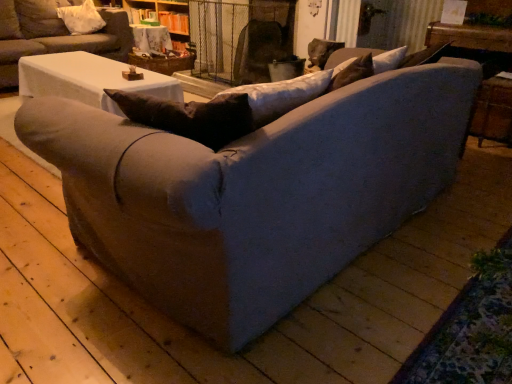
Question: Would you say white fabric pillow at upper left contains matte gray couch at center, arranged as the second studio couch when ordered from the bottom?

Choices:
 (A) yes
 (B) no

Answer: (B)

Question: Is white fabric pillow at upper left smaller than matte gray couch at center, arranged as the second studio couch when ordered from the bottom?

Choices:
 (A) no
 (B) yes

Answer: (B)

Question: Is white fabric pillow at upper left oriented away from matte gray couch at center, arranged as the second studio couch when ordered from the bottom?

Choices:
 (A) no
 (B) yes

Answer: (B)

Question: From a real-world perspective, is white fabric pillow at upper left positioned over matte gray couch at center, the 1th studio couch from the top, based on gravity?

Choices:
 (A) yes
 (B) no

Answer: (A)

Question: Considering the relative sizes of white fabric pillow at upper left and matte gray couch at center, arranged as the second studio couch when ordered from the bottom, in the image provided, is white fabric pillow at upper left thinner than matte gray couch at center, arranged as the second studio couch when ordered from the bottom,?

Choices:
 (A) yes
 (B) no

Answer: (A)

Question: Is matte gray couch at center, arranged as the second studio couch when ordered from the bottom, to the left or to the right of wooden textured table at upper center in the image?

Choices:
 (A) right
 (B) left

Answer: (B)

Question: From the image's perspective, is matte gray couch at center, the 1th studio couch from the top, above or below wooden textured table at upper center?

Choices:
 (A) below
 (B) above

Answer: (A)

Question: Is point (14, 84) positioned closer to the camera than point (133, 33)?

Choices:
 (A) closer
 (B) farther

Answer: (A)

Question: Considering the positions of matte gray couch at center, arranged as the second studio couch when ordered from the bottom, and wooden textured table at upper center in the image, is matte gray couch at center, arranged as the second studio couch when ordered from the bottom, taller or shorter than wooden textured table at upper center?

Choices:
 (A) tall
 (B) short

Answer: (A)

Question: In terms of width, does wooden textured table at upper center look wider or thinner when compared to matte gray couch at center, the 1th studio couch from the top?

Choices:
 (A) thin
 (B) wide

Answer: (A)

Question: Considering the positions of point (164, 31) and point (38, 26), is point (164, 31) closer or farther from the camera than point (38, 26)?

Choices:
 (A) closer
 (B) farther

Answer: (B)

Question: Relative to matte gray couch at center, the 1th studio couch from the top, is wooden textured table at upper center in front or behind?

Choices:
 (A) behind
 (B) front

Answer: (A)

Question: Considering the positions of wooden textured table at upper center and matte gray couch at center, the 1th studio couch from the top, in the image, is wooden textured table at upper center taller or shorter than matte gray couch at center, the 1th studio couch from the top,?

Choices:
 (A) tall
 (B) short

Answer: (B)

Question: Considering the positions of textured gray couch at center, which is the first studio couch in bottom-to-top order, and white fabric pillow at upper left in the image, is textured gray couch at center, which is the first studio couch in bottom-to-top order, wider or thinner than white fabric pillow at upper left?

Choices:
 (A) thin
 (B) wide

Answer: (B)

Question: From a real-world perspective, is textured gray couch at center, which is the first studio couch in bottom-to-top order, positioned above or below white fabric pillow at upper left?

Choices:
 (A) below
 (B) above

Answer: (A)